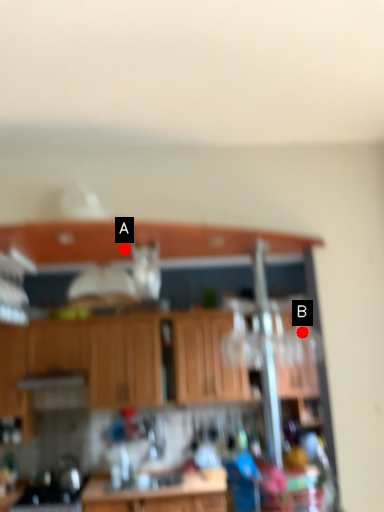
Question: Two points are circled on the image, labeled by A and B beside each circle. Which point is closer to the camera taking this photo?

Choices:
 (A) A is closer
 (B) B is closer

Answer: (A)